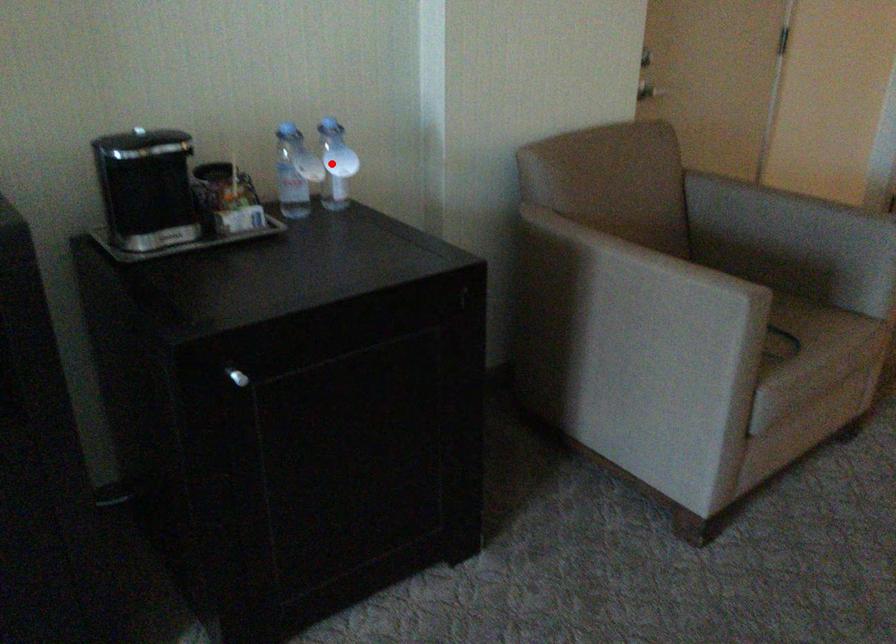
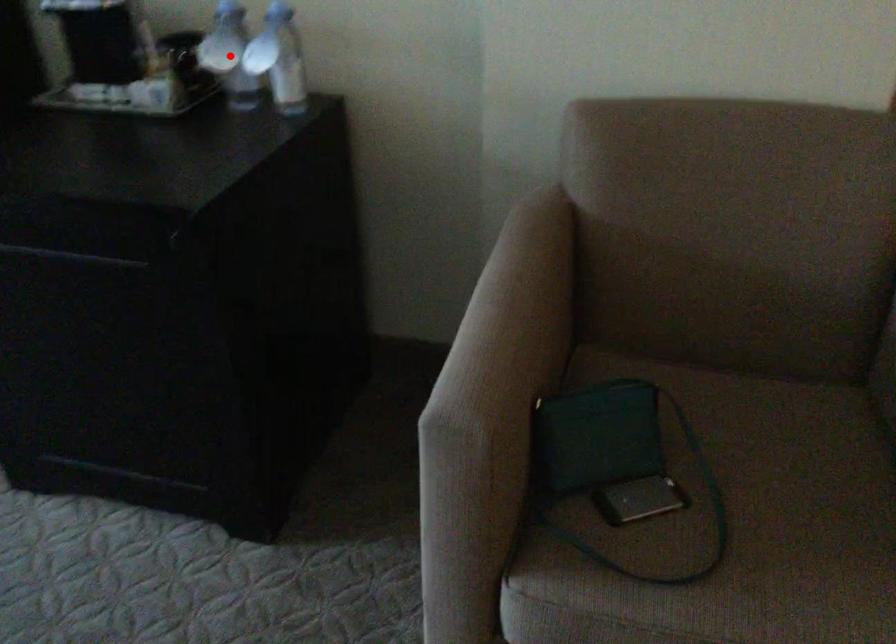
I am providing you with two images of the same scene from different viewpoints. A red point is marked on the first image and another point is marked on the second image. Do the highlighted points in image1 and image2 indicate the same real-world spot?

No